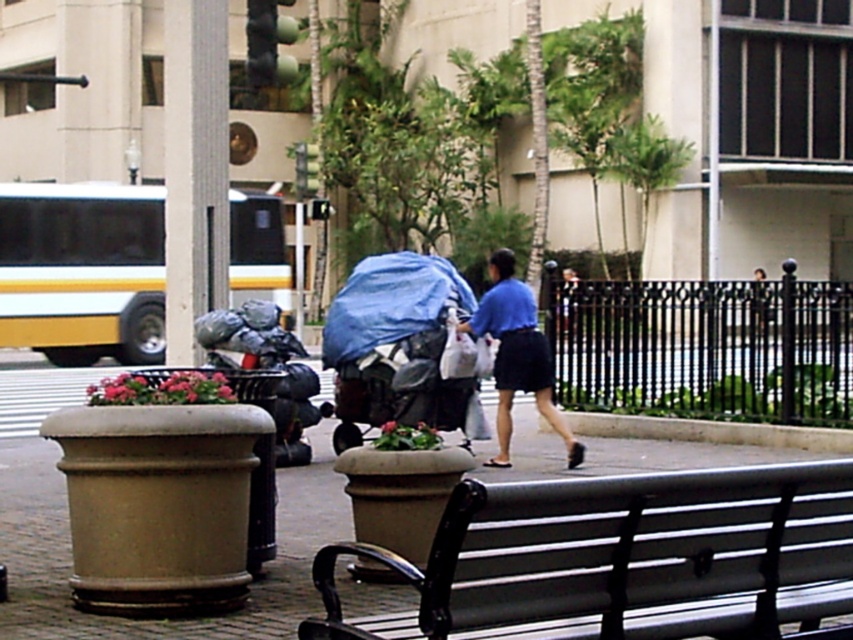
Question: Which object appears closest to the camera in this image?

Choices:
 (A) blue cotton shirt at center
 (B) smooth concrete pavement at center
 (C) metallic gray bench at lower center

Answer: (C)

Question: Which point is closer to the camera taking this photo?

Choices:
 (A) (36, 461)
 (B) (532, 518)
 (C) (503, 376)

Answer: (B)

Question: Can you confirm if metallic gray bench at lower center is positioned below blue cotton shirt at center?

Choices:
 (A) yes
 (B) no

Answer: (A)

Question: In this image, where is metallic gray bench at lower center located relative to smooth concrete pavement at center?

Choices:
 (A) right
 (B) left

Answer: (A)

Question: Does metallic gray bench at lower center appear on the right side of smooth concrete pavement at center?

Choices:
 (A) yes
 (B) no

Answer: (A)

Question: Based on their relative distances, which object is nearer to the metallic gray bench at lower center?

Choices:
 (A) smooth concrete pavement at center
 (B) blue cotton shirt at center

Answer: (A)